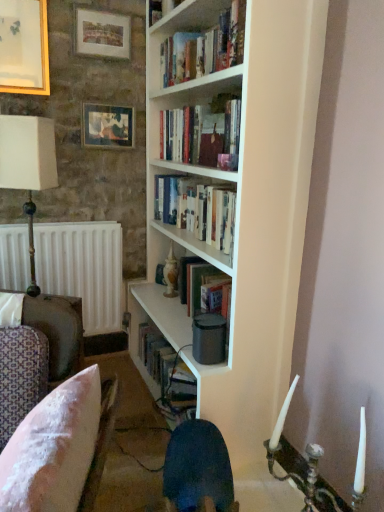
Question: Which direction should I rotate to face hardcover books at center, arranged as the 1th book when ordered from the bottom, — up or down?

Choices:
 (A) up
 (B) down

Answer: (A)

Question: Is the position of pink fabric cushion at lower left less distant than that of hardcover books at center, the second book viewed from the top?

Choices:
 (A) no
 (B) yes

Answer: (B)

Question: Is pink fabric cushion at lower left at the right side of hardcover books at center, arranged as the 1th book when ordered from the bottom?

Choices:
 (A) yes
 (B) no

Answer: (B)

Question: Considering the relative sizes of pink fabric cushion at lower left and hardcover books at center, arranged as the 1th book when ordered from the bottom, in the image provided, is pink fabric cushion at lower left bigger than hardcover books at center, arranged as the 1th book when ordered from the bottom,?

Choices:
 (A) no
 (B) yes

Answer: (B)

Question: Does pink fabric cushion at lower left contain hardcover books at center, the second book viewed from the top?

Choices:
 (A) no
 (B) yes

Answer: (A)

Question: Considering the relative sizes of pink fabric cushion at lower left and hardcover books at center, arranged as the 1th book when ordered from the bottom, in the image provided, is pink fabric cushion at lower left shorter than hardcover books at center, arranged as the 1th book when ordered from the bottom,?

Choices:
 (A) yes
 (B) no

Answer: (B)

Question: Can you confirm if pink fabric cushion at lower left is positioned to the left of hardcover books at center, arranged as the 1th book when ordered from the bottom?

Choices:
 (A) yes
 (B) no

Answer: (A)

Question: Is the depth of hardcover books at center, the second book viewed from the top, less than that of wooden picture frame at upper left, the 1th picture frame viewed from the left?

Choices:
 (A) yes
 (B) no

Answer: (A)

Question: Is hardcover books at center, arranged as the 1th book when ordered from the bottom, with wooden picture frame at upper left, which appears as the 3th picture frame when viewed from the right?

Choices:
 (A) no
 (B) yes

Answer: (A)

Question: Does hardcover books at center, the second book viewed from the top, have a smaller size compared to wooden picture frame at upper left, which appears as the 3th picture frame when viewed from the right?

Choices:
 (A) yes
 (B) no

Answer: (B)

Question: Is hardcover books at center, arranged as the 1th book when ordered from the bottom, far from wooden picture frame at upper left, the 1th picture frame viewed from the left?

Choices:
 (A) no
 (B) yes

Answer: (A)

Question: Does hardcover books at center, the second book viewed from the top, appear on the left side of wooden picture frame at upper left, which appears as the 3th picture frame when viewed from the right?

Choices:
 (A) yes
 (B) no

Answer: (B)

Question: Is wooden picture frame at upper left, which appears as the 3th picture frame when viewed from the right, located within hardcover books at center, the second book viewed from the top?

Choices:
 (A) yes
 (B) no

Answer: (B)

Question: Considering the relative positions of white fabric-covered lampshade at left and white matte bookcase at center in the image provided, is white fabric-covered lampshade at left behind white matte bookcase at center?

Choices:
 (A) no
 (B) yes

Answer: (B)